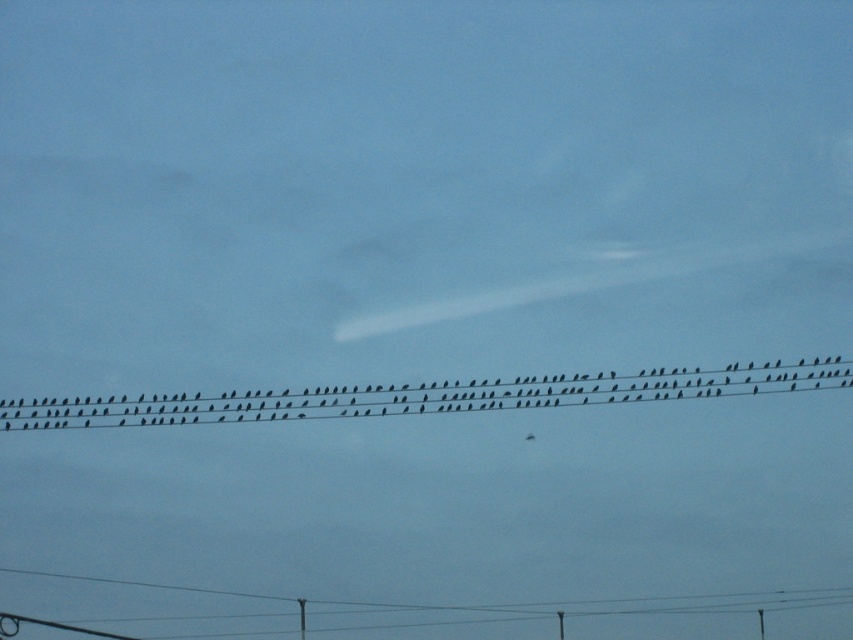
You are a birdwatcher standing 2 meters away from the smooth gray telegraph pole at lower right. You want to observe the black matte birds at center without moving closer. Can you see them clearly from your current position?

The black matte birds at center is 3.14 meters away from the smooth gray telegraph pole at lower right. Since you are standing 2 meters away from the pole, the birds are approximately 1.14 meters further away from you. This distance should allow you to see the birds clearly as they are perched on the power lines in plain sight.

You are an ornithologist studying bird behavior. You observe the black matte birds at center in the image. Based on their position, can you determine their exact 2D coordinates in the image?

The black matte birds at center are located at the 2D coordinates point (422, 396).